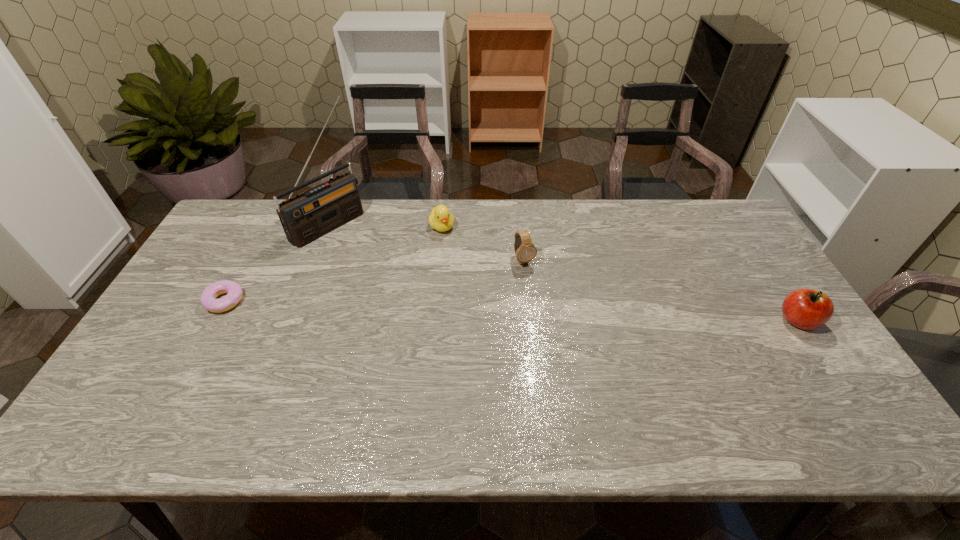
I want to click on free space located 0.090m on the back of the rightmost object, so click(x=774, y=284).

I want to click on vacant space situated 0.120m on the beak of the third object from left to right, so click(456, 259).

What are the coordinates of `blank space located 0.250m on the beak of the third object from left to right` in the screenshot? It's located at (468, 287).

Locate an element on the screen. free location located on the beak of the third object from left to right is located at coordinates (460, 267).

Locate an element on the screen. The height and width of the screenshot is (540, 960). free space located 0.380m on the front-facing side of the tallest object is located at coordinates (423, 298).

At what (x,y) coordinates should I click in order to perform the action: click on free location located on the front-facing side of the tallest object. Please return your answer as a coordinate pair (x, y). Image resolution: width=960 pixels, height=540 pixels. Looking at the image, I should click on (403, 282).

Find the location of `vacant space situated 0.350m on the front-facing side of the tallest object`. vacant space situated 0.350m on the front-facing side of the tallest object is located at coordinates (417, 292).

At what (x,y) coordinates should I click in order to perform the action: click on free space located on the face of the fourth object from left to right. Please return your answer as a coordinate pair (x, y). The height and width of the screenshot is (540, 960). Looking at the image, I should click on (557, 323).

Locate an element on the screen. free space located 0.120m on the face of the fourth object from left to right is located at coordinates (542, 297).

The height and width of the screenshot is (540, 960). Identify the location of vacant space positioned 0.200m on the face of the fourth object from left to right. (554, 318).